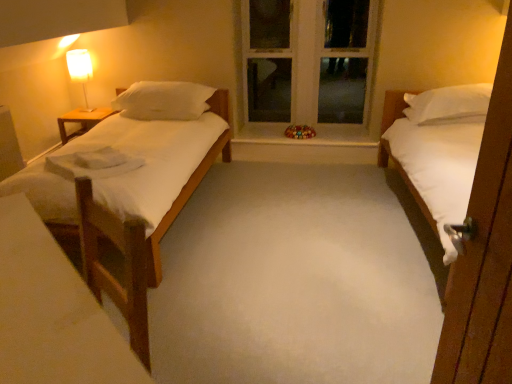
Question: Is white matte bed at right facing towards white soft pillow at left?

Choices:
 (A) no
 (B) yes

Answer: (A)

Question: From a real-world perspective, is white matte bed at right below white soft pillow at left?

Choices:
 (A) no
 (B) yes

Answer: (B)

Question: Does white matte bed at right contain white soft pillow at left?

Choices:
 (A) yes
 (B) no

Answer: (B)

Question: Is white matte bed at right looking in the opposite direction of white soft pillow at left?

Choices:
 (A) no
 (B) yes

Answer: (A)

Question: From the image's perspective, is white matte bed at right on white soft pillow at left?

Choices:
 (A) yes
 (B) no

Answer: (B)

Question: In terms of height, does wooden table at left look taller or shorter compared to smooth glass window sill at center?

Choices:
 (A) short
 (B) tall

Answer: (B)

Question: Looking at the image, does wooden table at left seem bigger or smaller compared to smooth glass window sill at center?

Choices:
 (A) big
 (B) small

Answer: (A)

Question: From the image's perspective, relative to smooth glass window sill at center, is wooden table at left above or below?

Choices:
 (A) above
 (B) below

Answer: (A)

Question: Is point (114, 112) closer or farther from the camera than point (349, 137)?

Choices:
 (A) farther
 (B) closer

Answer: (B)

Question: From the image's perspective, is white soft pillow at left located above or below wooden vanity at left?

Choices:
 (A) below
 (B) above

Answer: (B)

Question: From their relative heights in the image, would you say white soft pillow at left is taller or shorter than wooden vanity at left?

Choices:
 (A) short
 (B) tall

Answer: (A)

Question: Looking at their shapes, would you say white soft pillow at left is wider or thinner than wooden vanity at left?

Choices:
 (A) wide
 (B) thin

Answer: (A)

Question: In the image, is white soft pillow at left on the left side or the right side of wooden vanity at left?

Choices:
 (A) left
 (B) right

Answer: (A)

Question: From the image's perspective, relative to wooden vanity at left, is matte white lamp at upper left above or below?

Choices:
 (A) above
 (B) below

Answer: (A)

Question: From a real-world perspective, is matte white lamp at upper left above or below wooden vanity at left?

Choices:
 (A) above
 (B) below

Answer: (A)